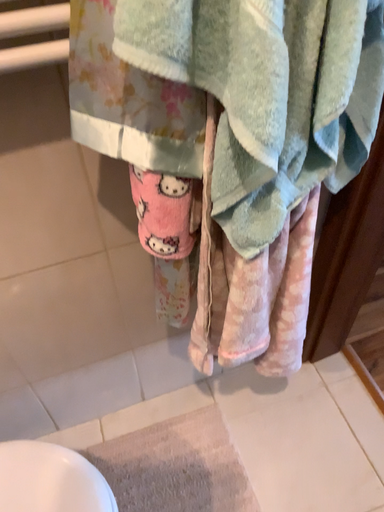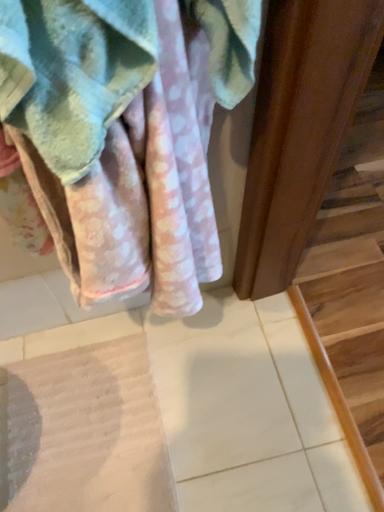
Question: How did the camera likely rotate when shooting the video?

Choices:
 (A) rotated upward
 (B) rotated downward

Answer: (B)